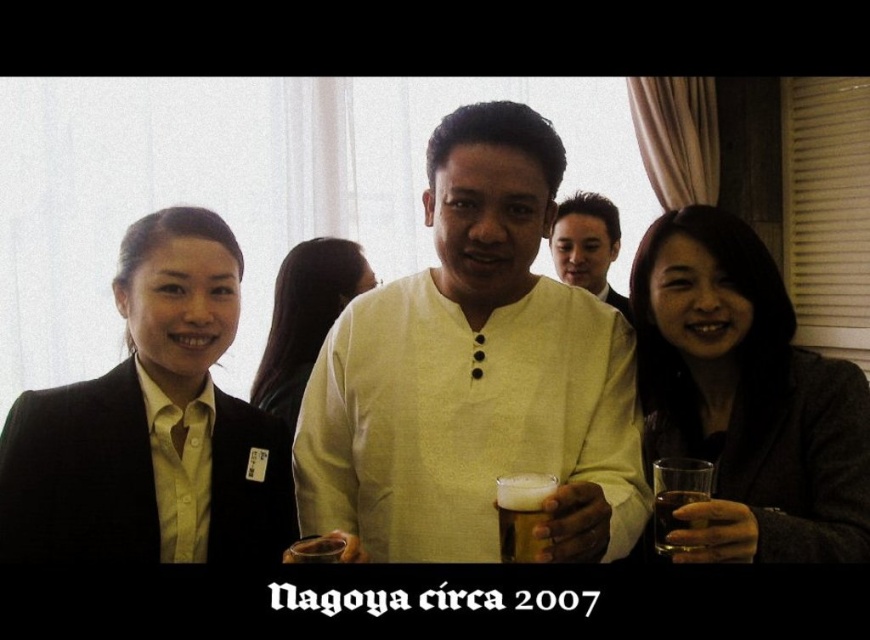
Describe the element at coordinates (152, 426) in the screenshot. This screenshot has width=870, height=640. I see `matte black blazer at left` at that location.

Does matte black blazer at left appear on the left side of golden amber liquid at center?

Correct, you'll find matte black blazer at left to the left of golden amber liquid at center.

Locate an element on the screen. The image size is (870, 640). matte black blazer at left is located at coordinates (152, 426).

Between light yellow cotton shirt at center and golden amber liquid at center, which one appears on the left side from the viewer's perspective?

Positioned to the left is golden amber liquid at center.

Based on the photo, is light yellow cotton shirt at center positioned behind golden amber liquid at center?

Yes, light yellow cotton shirt at center is further from the viewer.

Is point (536, 360) positioned in front of point (293, 547)?

No, (536, 360) is further to viewer.

Where is `light yellow cotton shirt at center`? This screenshot has height=640, width=870. light yellow cotton shirt at center is located at coordinates (474, 374).

Can you confirm if matte black blazer at left is smaller than matte black blazer at center?

No.

Is point (152, 456) farther from camera compared to point (613, 209)?

No, it is in front of (613, 209).

This screenshot has height=640, width=870. What do you see at coordinates (152, 426) in the screenshot?
I see `matte black blazer at left` at bounding box center [152, 426].

Locate an element on the screen. The image size is (870, 640). matte black blazer at left is located at coordinates (152, 426).